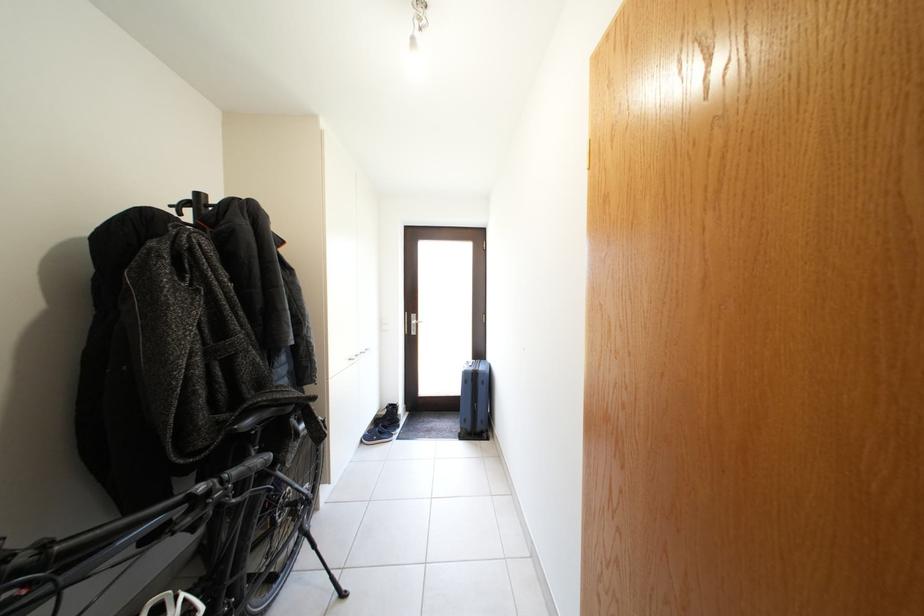
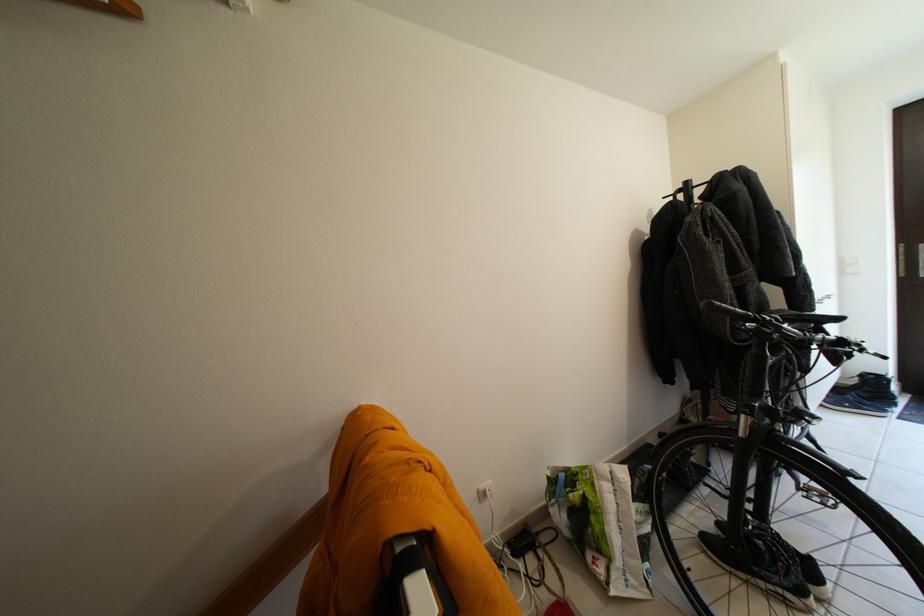
The point at (198, 503) is marked in the first image. Where is the corresponding point in the second image?

(849, 344)